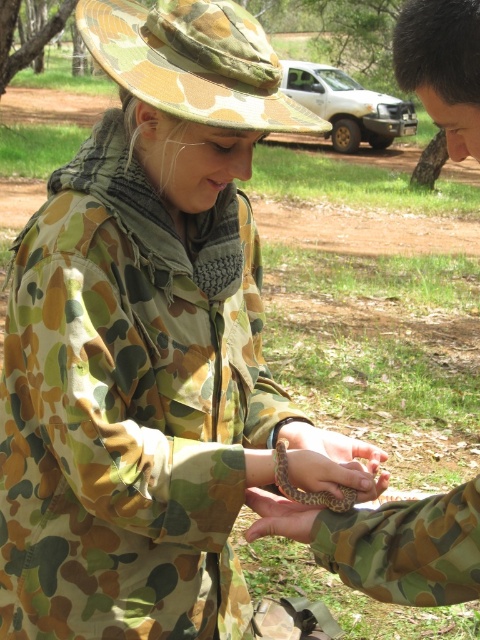
Question: Which point is closer to the camera?

Choices:
 (A) coord(465,20)
 (B) coord(296,429)

Answer: (A)

Question: Does camouflage fabric arm at center lie in front of camouflage-patterned hand at center?

Choices:
 (A) no
 (B) yes

Answer: (B)

Question: Does camouflage fabric arm at center have a lesser width compared to camouflage-patterned hand at center?

Choices:
 (A) no
 (B) yes

Answer: (A)

Question: Which point appears farthest from the camera in this image?

Choices:
 (A) (356, 467)
 (B) (443, 92)

Answer: (A)

Question: Is camouflage fabric arm at center above camouflage-patterned hand at center?

Choices:
 (A) no
 (B) yes

Answer: (A)